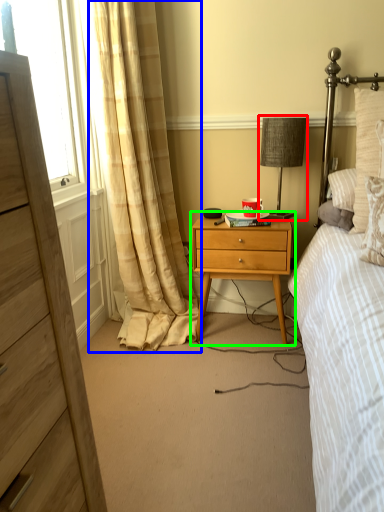
Question: Which is nearer to the bedside lamp (highlighted by a red box)? curtain (highlighted by a blue box) or nightstand (highlighted by a green box).

Choices:
 (A) curtain
 (B) nightstand

Answer: (B)